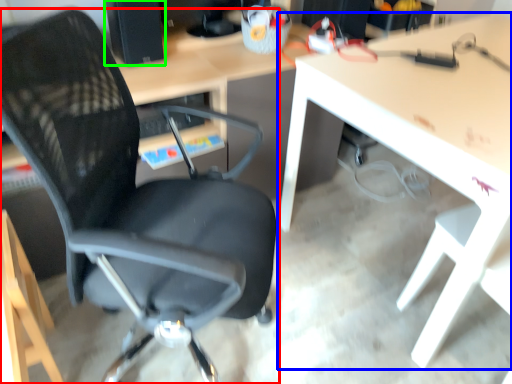
Question: Which object is the farthest from chair (highlighted by a red box)? Choose among these: table (highlighted by a blue box) or desktop computer (highlighted by a green box).

Choices:
 (A) table
 (B) desktop computer

Answer: (B)